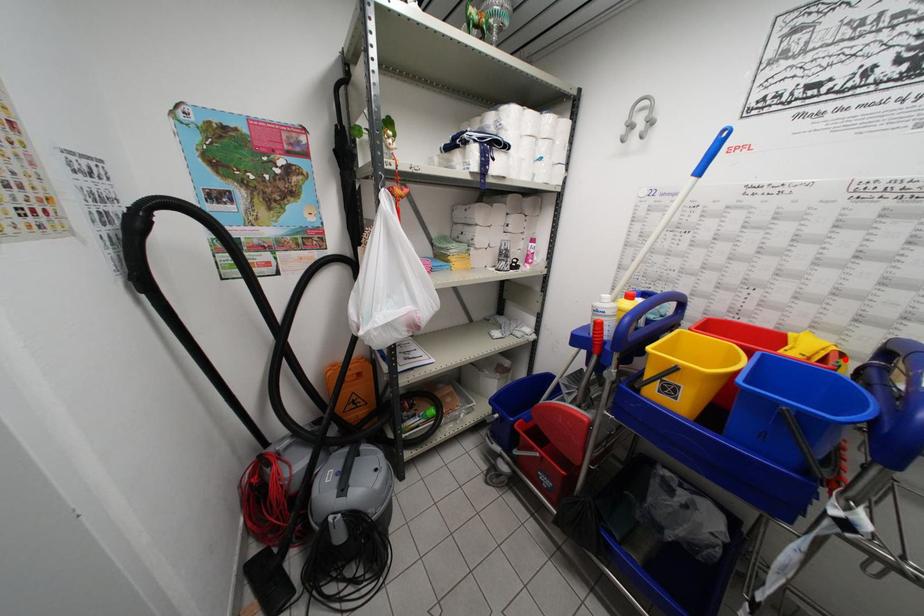
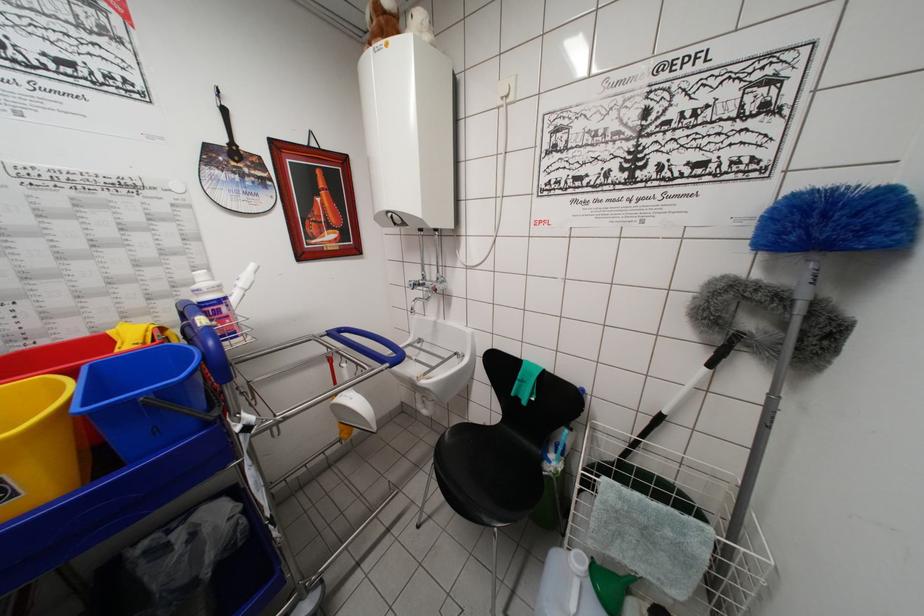
Locate, in the second image, the point that corresponds to the highlighted location in the first image.

(165, 333)